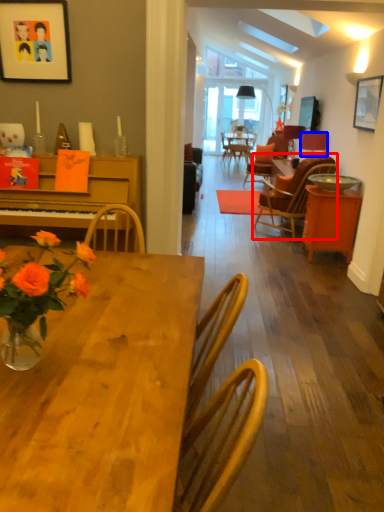
Question: Which object appears farthest to the camera in this image, chair (highlighted by a red box) or lamp (highlighted by a blue box)?

Choices:
 (A) chair
 (B) lamp

Answer: (B)